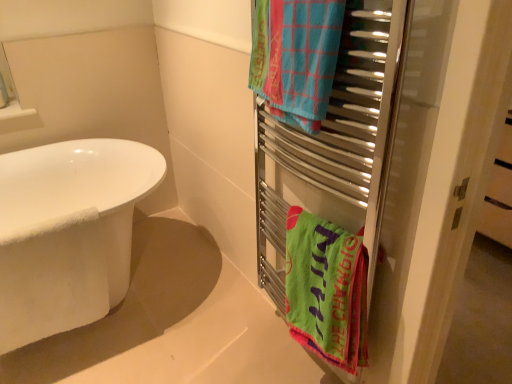
Question: Does metal towel rack at right lie behind green fabric towel at right, arranged as the first towel/napkin when ordered from the bottom?

Choices:
 (A) no
 (B) yes

Answer: (A)

Question: From a real-world perspective, is metal towel rack at right over green fabric towel at right, the 2th towel/napkin in the top-to-bottom sequence?

Choices:
 (A) yes
 (B) no

Answer: (A)

Question: From the image's perspective, is metal towel rack at right on green fabric towel at right, arranged as the first towel/napkin when ordered from the bottom?

Choices:
 (A) no
 (B) yes

Answer: (B)

Question: Can you confirm if metal towel rack at right is taller than green fabric towel at right, arranged as the first towel/napkin when ordered from the bottom?

Choices:
 (A) no
 (B) yes

Answer: (B)

Question: Is metal towel rack at right positioned in front of green fabric towel at right, arranged as the first towel/napkin when ordered from the bottom?

Choices:
 (A) yes
 (B) no

Answer: (A)

Question: From a real-world perspective, is white matte bathtub at lower left above or below blue woven towel at upper right, the 2th towel/napkin positioned from the bottom?

Choices:
 (A) below
 (B) above

Answer: (A)

Question: Considering the relative positions of white matte bathtub at lower left and blue woven towel at upper right, which appears as the 1th towel/napkin when viewed from the top, in the image provided, is white matte bathtub at lower left to the left or to the right of blue woven towel at upper right, which appears as the 1th towel/napkin when viewed from the top,?

Choices:
 (A) right
 (B) left

Answer: (B)

Question: Based on their sizes in the image, would you say white matte bathtub at lower left is bigger or smaller than blue woven towel at upper right, the 2th towel/napkin positioned from the bottom?

Choices:
 (A) small
 (B) big

Answer: (B)

Question: Considering the positions of white matte bathtub at lower left and blue woven towel at upper right, the 2th towel/napkin positioned from the bottom, in the image, is white matte bathtub at lower left taller or shorter than blue woven towel at upper right, the 2th towel/napkin positioned from the bottom,?

Choices:
 (A) short
 (B) tall

Answer: (A)

Question: In terms of width, does metal towel rack at right look wider or thinner when compared to white matte bathtub at lower left?

Choices:
 (A) wide
 (B) thin

Answer: (B)

Question: Visually, is metal towel rack at right positioned to the left or to the right of white matte bathtub at lower left?

Choices:
 (A) right
 (B) left

Answer: (A)

Question: In terms of height, does metal towel rack at right look taller or shorter compared to white matte bathtub at lower left?

Choices:
 (A) tall
 (B) short

Answer: (A)

Question: From the image's perspective, relative to white matte bathtub at lower left, is metal towel rack at right above or below?

Choices:
 (A) below
 (B) above

Answer: (B)

Question: In terms of height, does metal towel rack at right look taller or shorter compared to blue woven towel at upper right, which appears as the 1th towel/napkin when viewed from the top?

Choices:
 (A) short
 (B) tall

Answer: (B)

Question: From a real-world perspective, is metal towel rack at right physically located above or below blue woven towel at upper right, the 2th towel/napkin positioned from the bottom?

Choices:
 (A) above
 (B) below

Answer: (B)